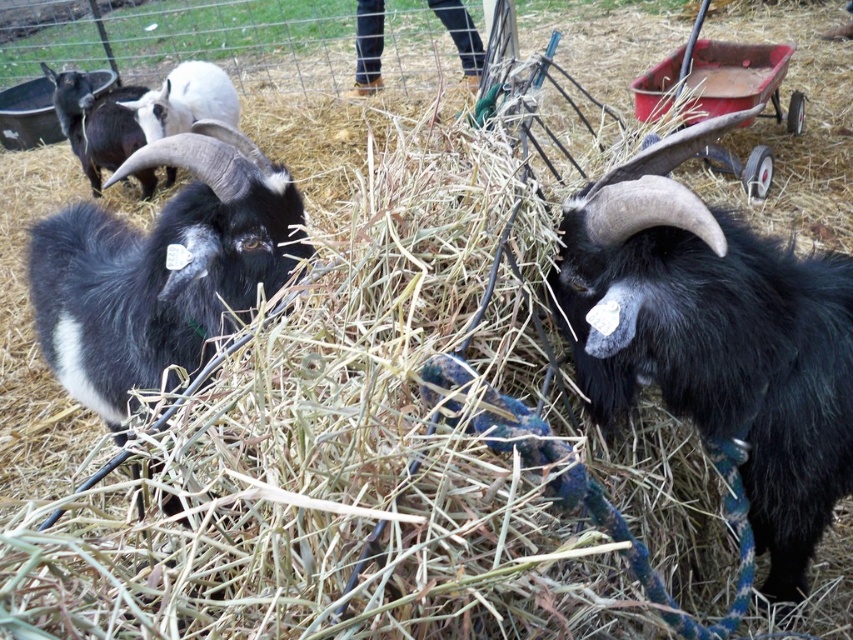
Between red metal cart at upper right and black woolen goat at upper left, which one appears on the left side from the viewer's perspective?

From the viewer's perspective, black woolen goat at upper left appears more on the left side.

Is point (767, 164) positioned before point (59, 109)?

Yes, point (767, 164) is in front of point (59, 109).

You are a GUI agent. You are given a task and a screenshot of the screen. Output one action in this format:
    pyautogui.click(x=<x>, y=<y>)
    Task: Click on the red metal cart at upper right
    The width and height of the screenshot is (853, 640).
    Given the screenshot: What is the action you would take?
    pyautogui.click(x=714, y=76)

Between black woolen goat at left and white woolen sheep at upper left, which one has less height?

Standing shorter between the two is black woolen goat at left.

Which is above, black woolen goat at left or white woolen sheep at upper left?

white woolen sheep at upper left is above.

Find the location of a particular element. The height and width of the screenshot is (640, 853). black woolen goat at left is located at coordinates (161, 269).

Is black woolen goat at center wider than black woolen goat at upper left?

No, black woolen goat at center is not wider than black woolen goat at upper left.

Is black woolen goat at center to the left of black woolen goat at upper left from the viewer's perspective?

No, black woolen goat at center is not to the left of black woolen goat at upper left.

Which is in front, point (654, 294) or point (131, 134)?

Point (654, 294) is more forward.

Find the location of a particular element. The image size is (853, 640). black woolen goat at center is located at coordinates (715, 337).